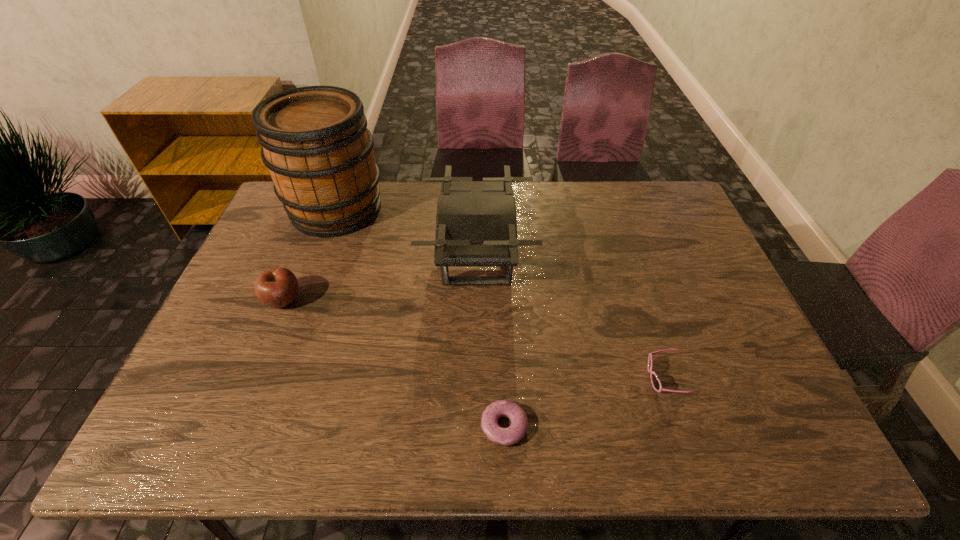
The image size is (960, 540). Find the location of `free space located on the front-facing side of the rightmost object`. free space located on the front-facing side of the rightmost object is located at coordinates (605, 379).

I want to click on free space located on the front-facing side of the rightmost object, so click(x=487, y=379).

This screenshot has height=540, width=960. I want to click on vacant space located 0.200m on the front-facing side of the rightmost object, so click(563, 379).

This screenshot has height=540, width=960. I want to click on free space located 0.300m on the right of the shortest object, so click(664, 426).

Where is `cider situated at the far edge`? The height and width of the screenshot is (540, 960). cider situated at the far edge is located at coordinates (315, 142).

This screenshot has width=960, height=540. Find the location of `drone positioned at the far edge`. drone positioned at the far edge is located at coordinates (476, 225).

Where is `object that is positioned at the near edge`? This screenshot has height=540, width=960. object that is positioned at the near edge is located at coordinates (516, 431).

Image resolution: width=960 pixels, height=540 pixels. Find the location of `cider that is at the left edge`. cider that is at the left edge is located at coordinates (315, 142).

Where is `apple at the left edge`? apple at the left edge is located at coordinates (278, 287).

Identify the location of object located in the far left corner section of the desktop. The image size is (960, 540). (315, 142).